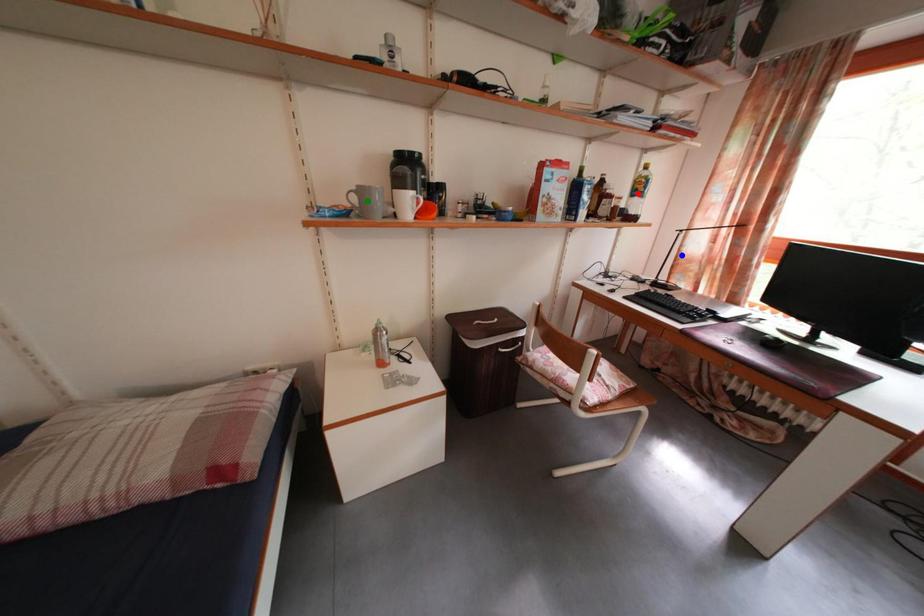
Order these from nearest to farthest:
red point
blue point
green point

green point, red point, blue point